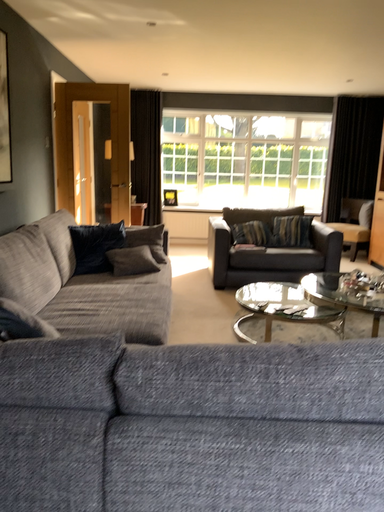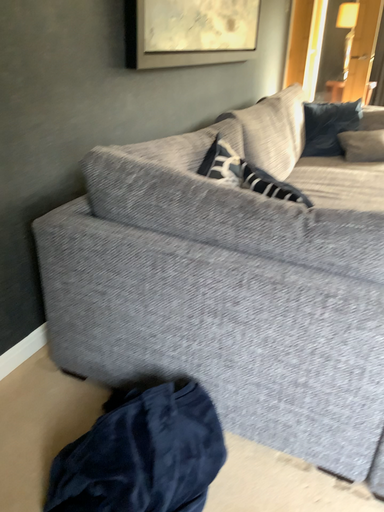
Question: How did the camera likely rotate when shooting the video?

Choices:
 (A) rotated upward
 (B) rotated downward

Answer: (B)